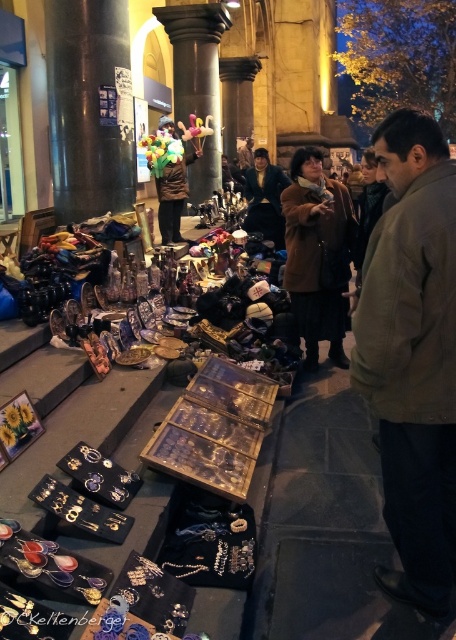
In the bustling night market scene, you see a brown woolen jacket at right and a velvet brown coat at center. Which one is positioned more to the right side of the scene?

The brown woolen jacket at right is positioned more to the right side of the scene because it is located to the right of the velvet brown coat at center.